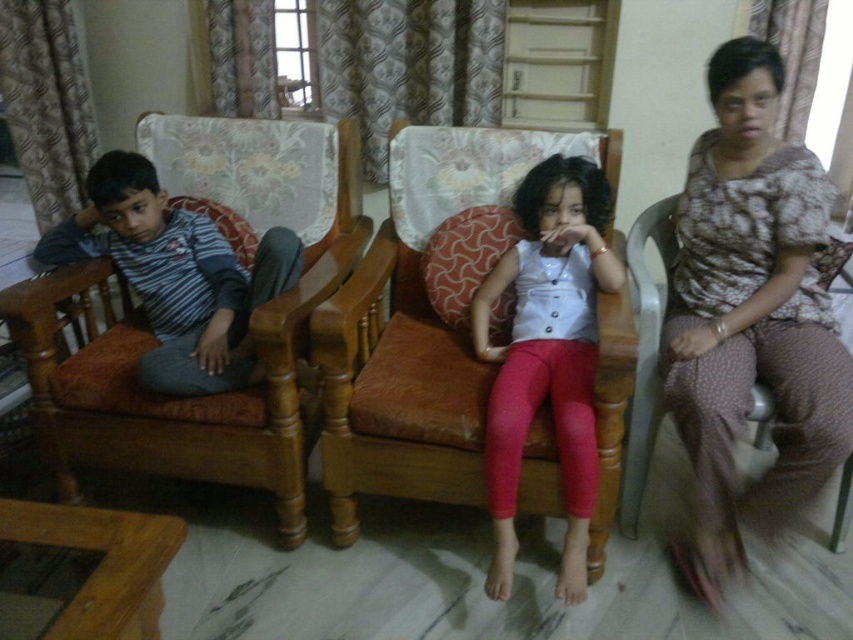
Question: Which point appears closest to the camera in this image?

Choices:
 (A) (177, 140)
 (B) (714, 97)

Answer: (B)

Question: Which of the following is the farthest from the observer?

Choices:
 (A) (x=618, y=346)
 (B) (x=57, y=371)
 (C) (x=796, y=337)
 (D) (x=167, y=324)

Answer: (D)

Question: Does wooden armchair at left have a smaller size compared to matte orange cushioned chair at center?

Choices:
 (A) no
 (B) yes

Answer: (B)

Question: Which is nearer to the matte orange cushioned chair at center?

Choices:
 (A) wooden armchair at left
 (B) striped cotton shirt at left

Answer: (A)

Question: Can you confirm if wooden armchair at left is positioned below striped cotton shirt at left?

Choices:
 (A) no
 (B) yes

Answer: (B)

Question: Is wooden armchair at left to the left of striped cotton shirt at left from the viewer's perspective?

Choices:
 (A) yes
 (B) no

Answer: (B)